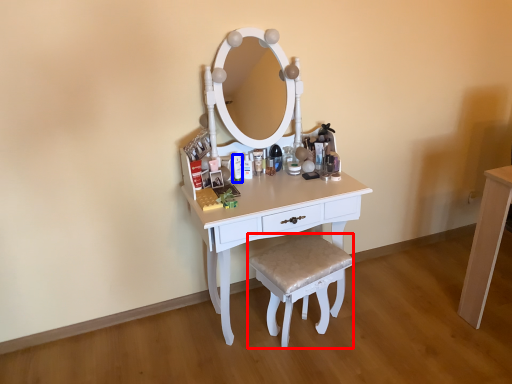
Question: Which point is further to the camera, stool (highlighted by a red box) or toiletry (highlighted by a blue box)?

Choices:
 (A) stool
 (B) toiletry

Answer: (B)